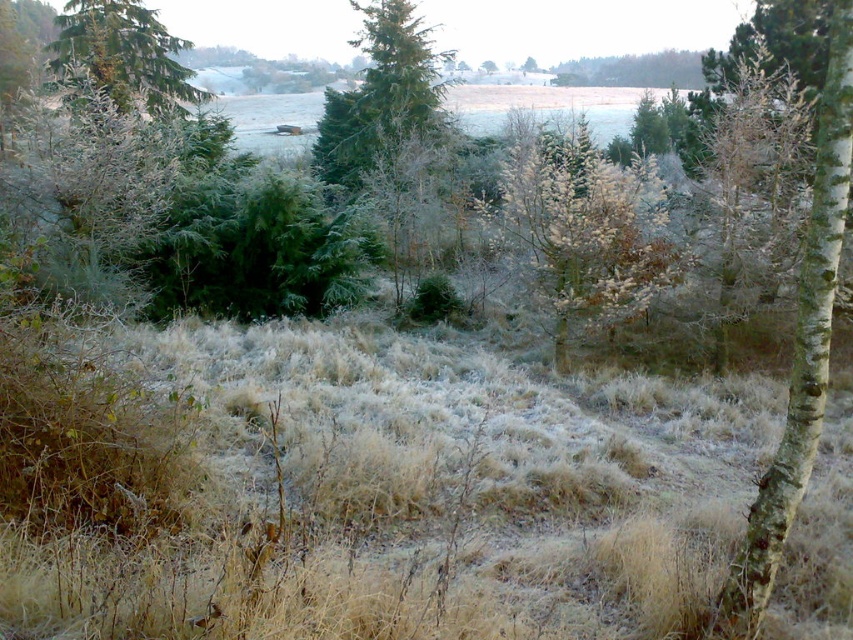
You are a hiker trying to navigate through the winter landscape. You see the white bark tree at right and the green matte tree at center. Which tree is closer to the ground?

The white bark tree at right is positioned under the green matte tree at center, so it is closer to the ground.